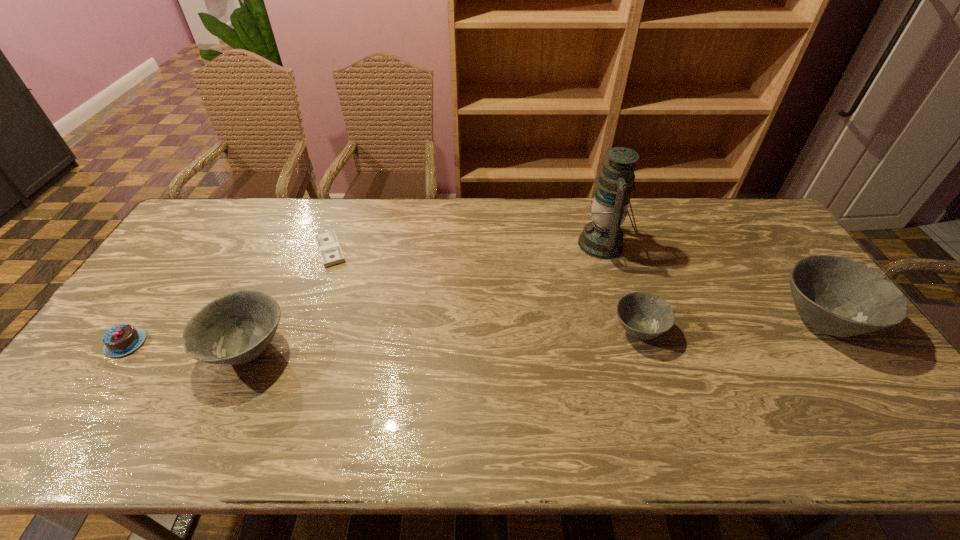
Locate an element on the screen. Image resolution: width=960 pixels, height=540 pixels. the leftmost bowl is located at coordinates (236, 328).

Find the location of a particular element. This screenshot has width=960, height=540. the second shortest bowl is located at coordinates (236, 328).

At what (x,y) coordinates should I click in order to perform the action: click on the second bowl from right to left. Please return your answer as a coordinate pair (x, y). Looking at the image, I should click on (643, 315).

Image resolution: width=960 pixels, height=540 pixels. What are the coordinates of `the third shortest object` in the screenshot? It's located at (643, 315).

The image size is (960, 540). I want to click on the rightmost object, so click(x=840, y=297).

This screenshot has width=960, height=540. What are the coordinates of `the tallest object` in the screenshot? It's located at (602, 238).

This screenshot has height=540, width=960. Identify the location of the shortest object. (331, 253).

Find the location of a particular element. The height and width of the screenshot is (540, 960). the leftmost object is located at coordinates (120, 340).

This screenshot has width=960, height=540. Find the location of `chocolate cake`. chocolate cake is located at coordinates (120, 340).

In order to click on free space located on the back of the second shortest bowl in this screenshot , I will do `click(292, 253)`.